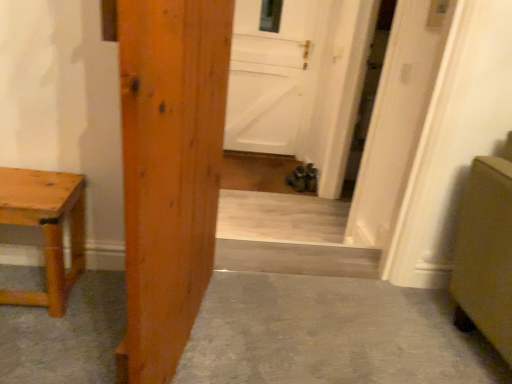
Identify the location of vacant area situated below natural wood table at left (from a real-world perspective). (31, 276).